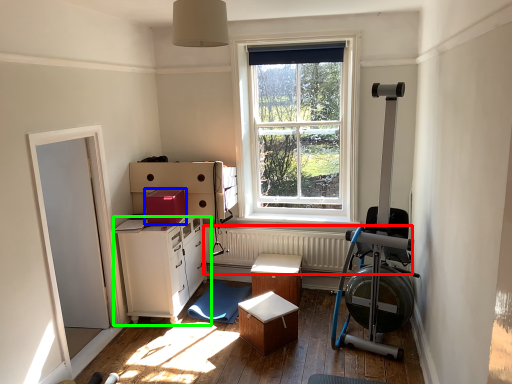
Question: Which is nearer to the radiator (highlighted by a red box)? cardboard box (highlighted by a blue box) or cabinetry (highlighted by a green box).

Choices:
 (A) cardboard box
 (B) cabinetry

Answer: (B)